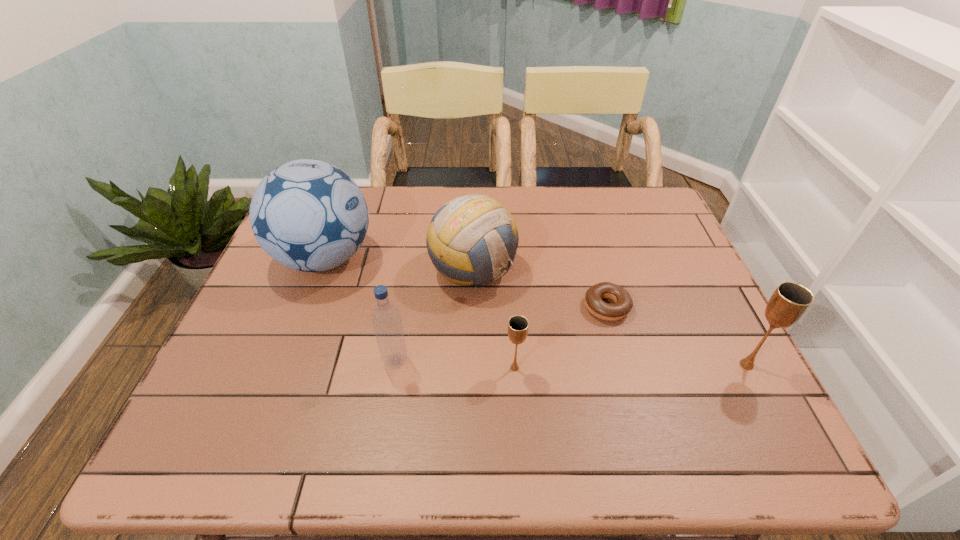
Identify the location of object that is at the near right corner. The height and width of the screenshot is (540, 960). (789, 302).

This screenshot has height=540, width=960. Identify the location of free region at the far edge of the desktop. (533, 203).

You are a GUI agent. You are given a task and a screenshot of the screen. Output one action in this format:
    pyautogui.click(x=<x>, y=<y>)
    Task: Click on the free region at the near edge
    
    Given the screenshot: What is the action you would take?
    pyautogui.click(x=421, y=398)

The width and height of the screenshot is (960, 540). In the image, there is a desktop. What are the coordinates of `blank space at the left edge` in the screenshot? It's located at (295, 320).

What are the coordinates of `vacant space at the right edge` in the screenshot? It's located at (635, 260).

Image resolution: width=960 pixels, height=540 pixels. I want to click on free space at the near left corner of the desktop, so pos(276,398).

What are the coordinates of `free location at the far right corner of the desktop` in the screenshot? It's located at (619, 206).

Locate an element on the screen. The image size is (960, 540). vacant space at the near right corner is located at coordinates [744, 384].

This screenshot has height=540, width=960. In order to click on vacant space that's between the shortest object and the taller chalice in this screenshot , I will do `click(677, 336)`.

The height and width of the screenshot is (540, 960). What are the coordinates of `unoccupied area between the taller chalice and the shorter chalice` in the screenshot? It's located at (631, 366).